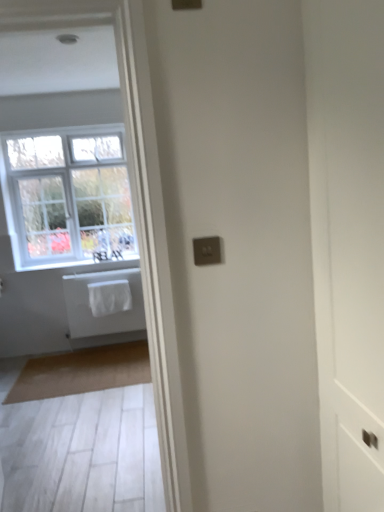
Question: Is point (213, 242) positioned closer to the camera than point (104, 310)?

Choices:
 (A) closer
 (B) farther

Answer: (A)

Question: In terms of size, does satin gold switchplate at center appear bigger or smaller than white fabric laundry at center?

Choices:
 (A) big
 (B) small

Answer: (B)

Question: Based on their relative distances, which object is farther from the white fabric at lower left?

Choices:
 (A) white fabric laundry at center
 (B) satin gold switchplate at center
 (C) white matte towel at left
 (D) white painted wood window at upper left
 (E) beige carpet at lower left

Answer: (B)

Question: Estimate the real-world distances between objects in this image. Which object is closer to the white painted wood window at upper left?

Choices:
 (A) white fabric at lower left
 (B) white fabric laundry at center
 (C) beige carpet at lower left
 (D) satin gold switchplate at center
 (E) white matte towel at left

Answer: (A)